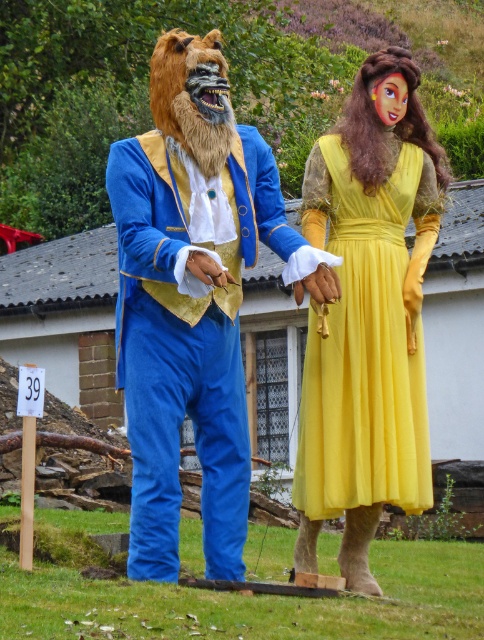
Does velvet blue suit at left appear over yellow satin dress at center?

Correct, velvet blue suit at left is located above yellow satin dress at center.

Describe the element at coordinates (367, 316) in the screenshot. The image size is (484, 640). I see `velvet blue suit at left` at that location.

At what (x,y) coordinates should I click in order to perform the action: click on velvet blue suit at left. Please return your answer as a coordinate pair (x, y). This screenshot has width=484, height=640. Looking at the image, I should click on [x=367, y=316].